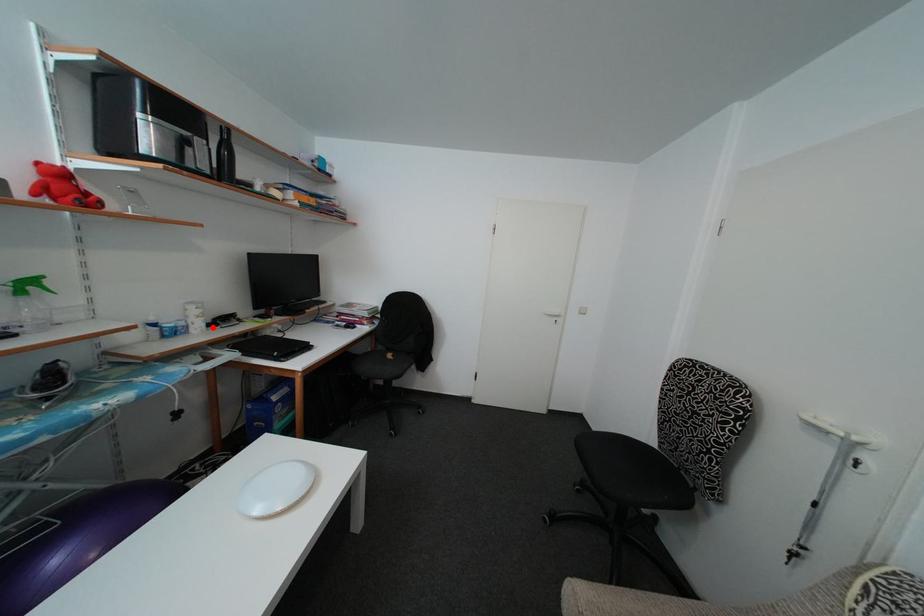
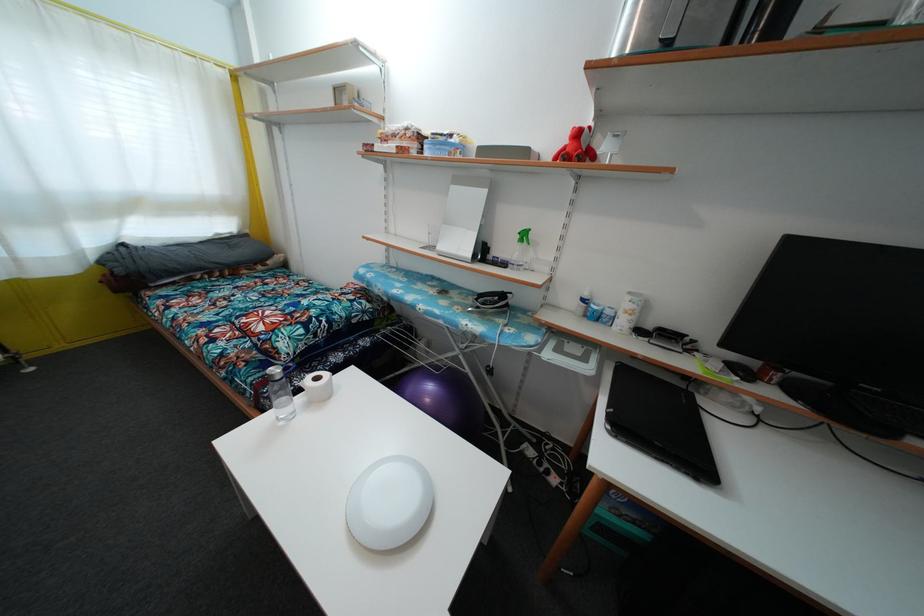
Where in the second image is the point corresponding to the highlighted location from the first image?

(652, 334)